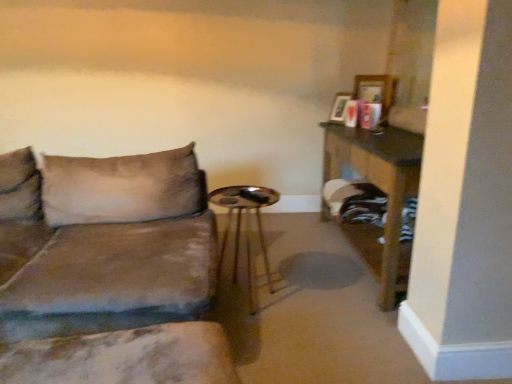
Identify the location of vacant region to the left of wooden table at right. The image size is (512, 384). (305, 256).